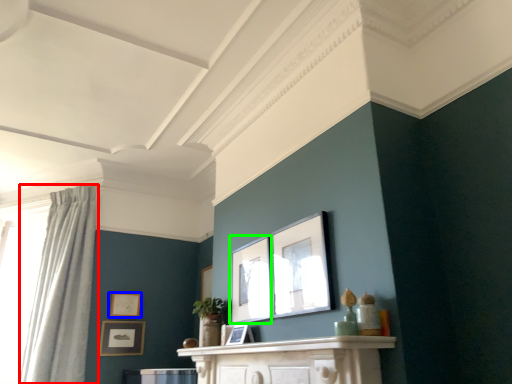
Question: Which object is the closest to the curtain (highlighted by a red box)? Choose among these: picture frame (highlighted by a blue box) or picture frame (highlighted by a green box).

Choices:
 (A) picture frame
 (B) picture frame

Answer: (A)